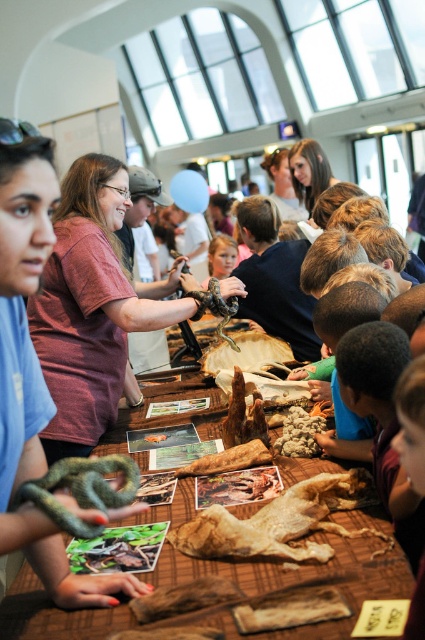
Question: Which point appears closest to the camera in this image?

Choices:
 (A) (302, 433)
 (B) (95, 604)

Answer: (B)

Question: Can you confirm if leather-like brown animal at center is thinner than brown leather table at center?

Choices:
 (A) no
 (B) yes

Answer: (A)

Question: Can you confirm if green scaly snake at lower left is smaller than brown crumbly bread at center?

Choices:
 (A) yes
 (B) no

Answer: (B)

Question: Estimate the real-world distances between objects in this image. Which object is farther from the brown crumbly bread at center?

Choices:
 (A) leather-like brown animal at center
 (B) brown leather table at center
 (C) green scaly snake at lower left

Answer: (C)

Question: Considering the relative positions of green scaly snake at lower left and shiny black snake at center in the image provided, where is green scaly snake at lower left located with respect to shiny black snake at center?

Choices:
 (A) below
 (B) above

Answer: (A)

Question: Which is nearer to the brown crumbly bread at center?

Choices:
 (A) leather-like brown animal at center
 (B) shiny black snake at center
 (C) green scaly snake at lower left

Answer: (A)